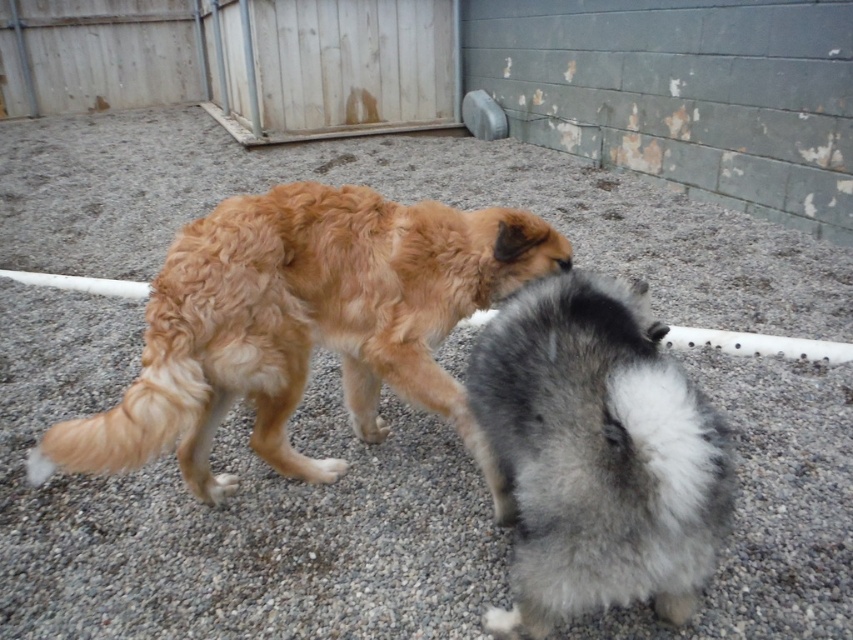
You are a dog owner observing the two dogs in the image. You notice the golden fur dog at center and the white fluffy paw at center. Which dog is bigger?

The golden fur dog at center is larger in size compared to the white fluffy paw at center.

You are a dog owner trying to identify which part of the dog is wider when looking at the image. The scene shows two dogs in a backyard with gravel. You see the fluffy gray fur at center and the white fluffy paw at center. Which one is wider?

The fluffy gray fur at center is wider than the white fluffy paw at center.